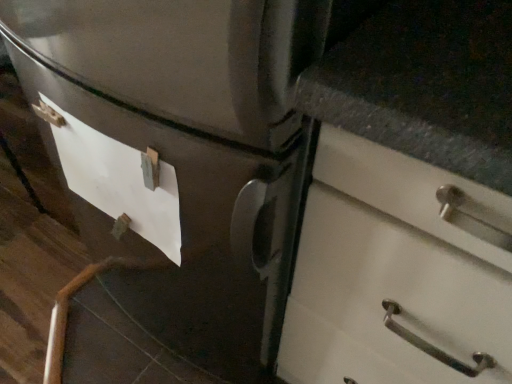
You are a GUI agent. You are given a task and a screenshot of the screen. Output one action in this format:
    pyautogui.click(x=<x>, y=<y>)
    Task: Click on the white matte paper at left
    Image resolution: width=512 pixels, height=384 pixels.
    Given the screenshot: What is the action you would take?
    pyautogui.click(x=119, y=182)

Measure the distance between white matte paper at left and camera.

A distance of 56.80 centimeters exists between white matte paper at left and camera.

This screenshot has height=384, width=512. Describe the element at coordinates (119, 182) in the screenshot. I see `white matte paper at left` at that location.

Identify the location of white matte paper at left. (119, 182).